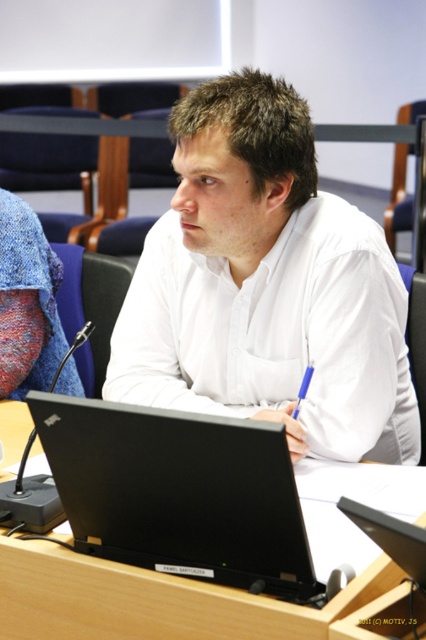
Question: Which object is positioned farthest from the white smooth shirt at center?

Choices:
 (A) black plastic table at center
 (B) black matte laptop at center

Answer: (B)

Question: Which of the following is the farthest from the observer?

Choices:
 (A) white smooth shirt at center
 (B) black matte laptop at center

Answer: (A)

Question: Which point is farther from the camera taking this photo?

Choices:
 (A) (258, 102)
 (B) (13, 604)
 (C) (367, 524)

Answer: (A)

Question: Can you confirm if black plastic table at center is positioned to the left of black matte laptop at center?

Choices:
 (A) yes
 (B) no

Answer: (A)

Question: Is black plastic table at center smaller than black matte laptop at center?

Choices:
 (A) no
 (B) yes

Answer: (A)

Question: Can you confirm if white smooth shirt at center is positioned to the left of black matte laptop at center?

Choices:
 (A) no
 (B) yes

Answer: (B)